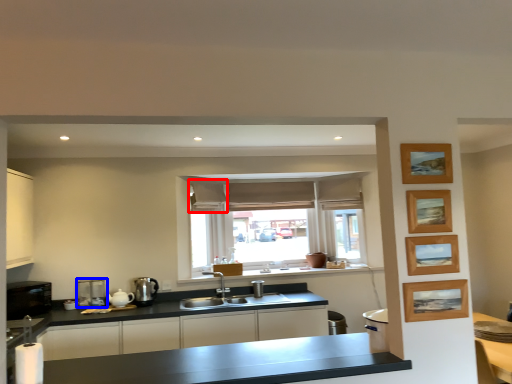
Question: Which point is further to the camera, curtain (highlighted by a red box) or coffee machine (highlighted by a blue box)?

Choices:
 (A) curtain
 (B) coffee machine

Answer: (A)